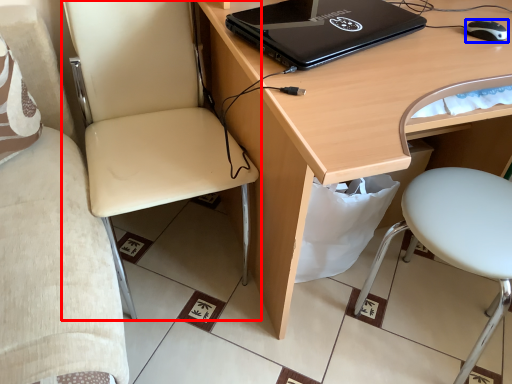
Question: Which object is further to the camera taking this photo, chair (highlighted by a red box) or mouse (highlighted by a blue box)?

Choices:
 (A) chair
 (B) mouse

Answer: (B)